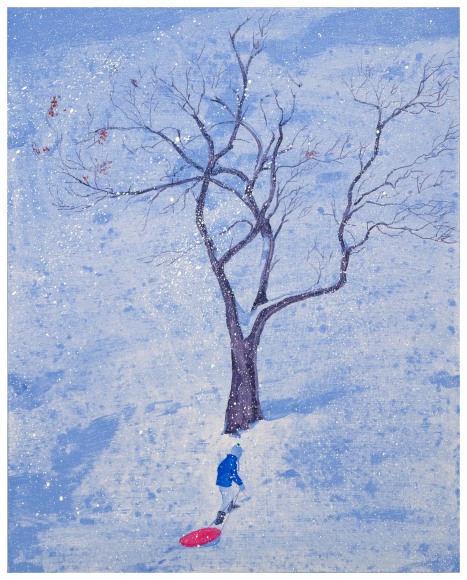
Where is `blue paint`? The height and width of the screenshot is (580, 467). blue paint is located at coordinates (85, 448).